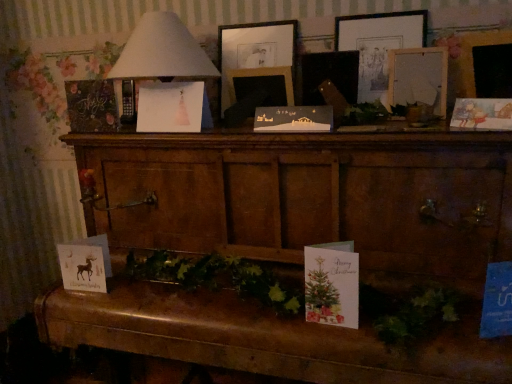
Find the location of a particular element. This screenshot has height=384, width=512. free space in front of matte black picture frame at center, marked as the 3th picture frame in a right-to-left arrangement is located at coordinates (269, 135).